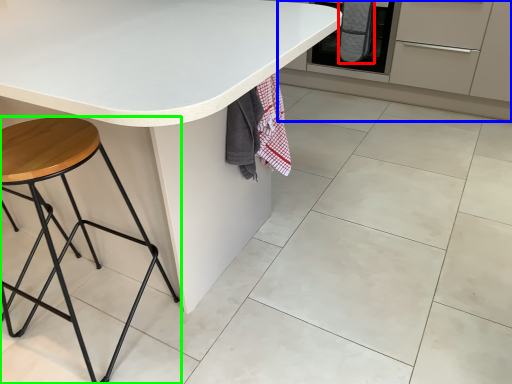
Question: Which is nearer to the blanket (highlighted by a red box)? cabinetry (highlighted by a blue box) or stool (highlighted by a green box).

Choices:
 (A) cabinetry
 (B) stool

Answer: (A)